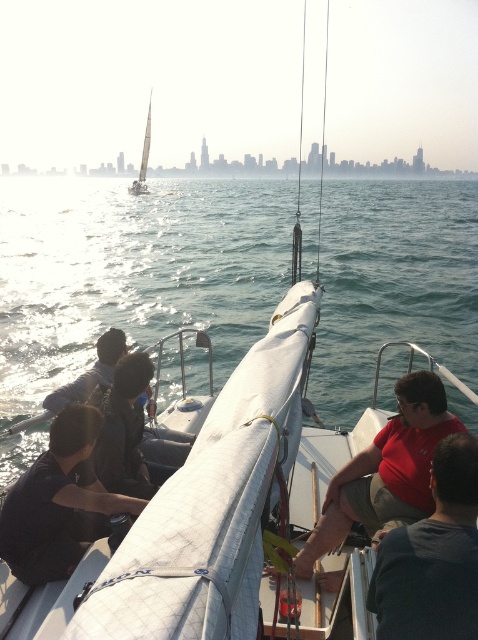
You are standing on the deck of the sailboat and see the point marked at coordinates (434, 556). What object is located at that point?

The point at coordinates (434, 556) indicates the red cotton shirt at center.

You are standing on the deck of the sailboat and notice two people wearing a red cotton shirt at center and a dark brown leather jacket at center. Which clothing item is positioned more to the right?

The red cotton shirt at center is positioned to the right of the dark brown leather jacket at center, so the red cotton shirt at center is more to the right.

Consider the image. You are standing on the deck of the sailboat and want to reach the point marked at coordinates point [446,332]. If your maximum reach is 60 feet, can you comfortably reach that point without moving?

The distance between you and point [446,332] is 62.74 feet, which exceeds your maximum reach of 60 feet. Therefore, you cannot comfortably reach that point without moving.